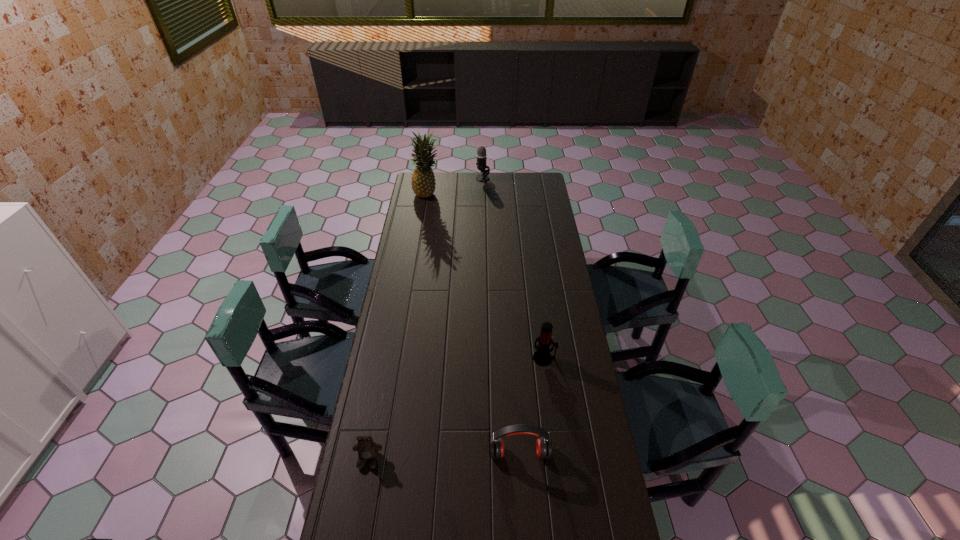
Locate an element on the screen. This screenshot has width=960, height=540. free location located on the left of the nearer microphone is located at coordinates (450, 358).

Locate an element on the screen. The image size is (960, 540). blank space located 0.160m on the ear cups of the earphone is located at coordinates (524, 515).

This screenshot has height=540, width=960. What are the coordinates of `vacant point located 0.140m on the face of the teddy bear` in the screenshot? It's located at (358, 517).

Locate an element on the screen. pineapple at the far edge is located at coordinates (423, 182).

I want to click on microphone at the far edge, so click(x=481, y=151).

Find the location of a particular element. Image resolution: width=960 pixels, height=540 pixels. pineapple present at the left edge is located at coordinates (423, 182).

Identify the location of teddy bear located in the left edge section of the desktop. (367, 449).

I want to click on object present at the right edge, so click(542, 356).

At what (x,y) coordinates should I click in order to perform the action: click on object located at the far left corner. Please return your answer as a coordinate pair (x, y). This screenshot has height=540, width=960. Looking at the image, I should click on (423, 182).

The image size is (960, 540). In the image, there is a desktop. Find the location of `free space at the left edge`. free space at the left edge is located at coordinates (420, 245).